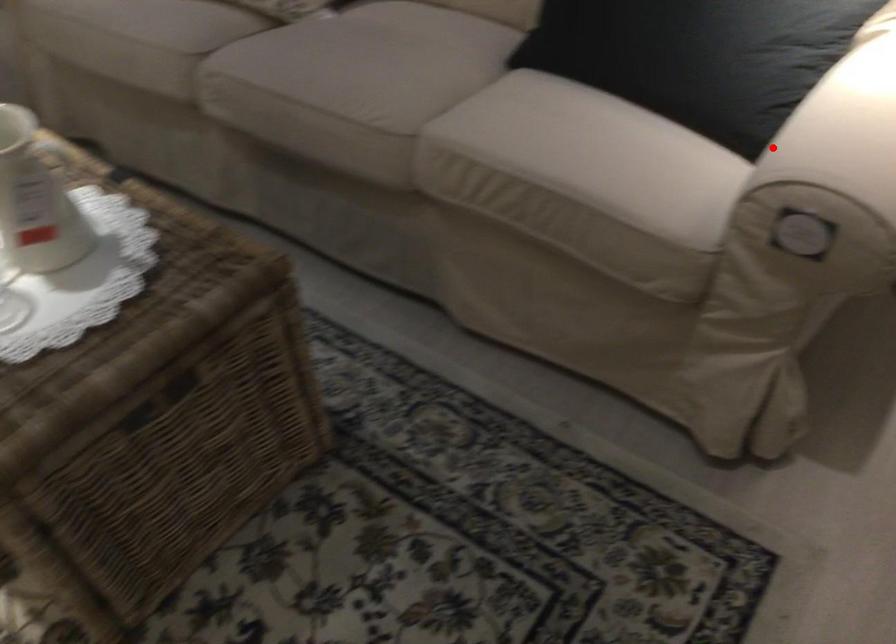
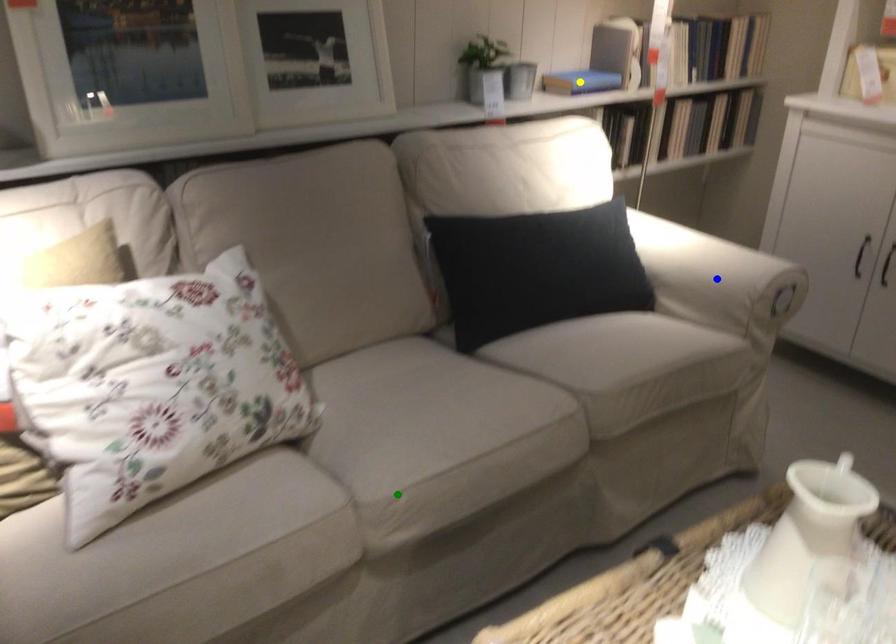
Question: I am providing you with two images of the same scene from different viewpoints. A red point is marked on the first image. You are given multiple points on the second image. Which point in image 2 represents the same 3d spot as the red point in image 1?

Choices:
 (A) green point
 (B) blue point
 (C) yellow point

Answer: (B)